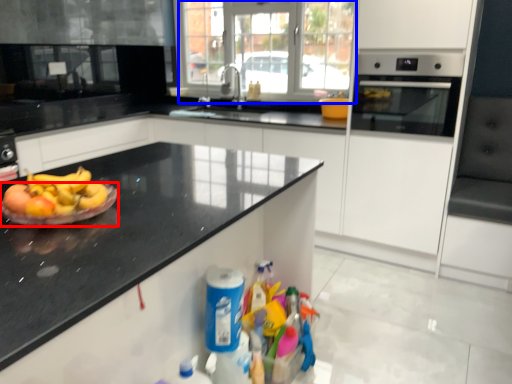
Question: Among these objects, which one is farthest to the camera, paper plate (highlighted by a red box) or glass door (highlighted by a blue box)?

Choices:
 (A) paper plate
 (B) glass door

Answer: (B)